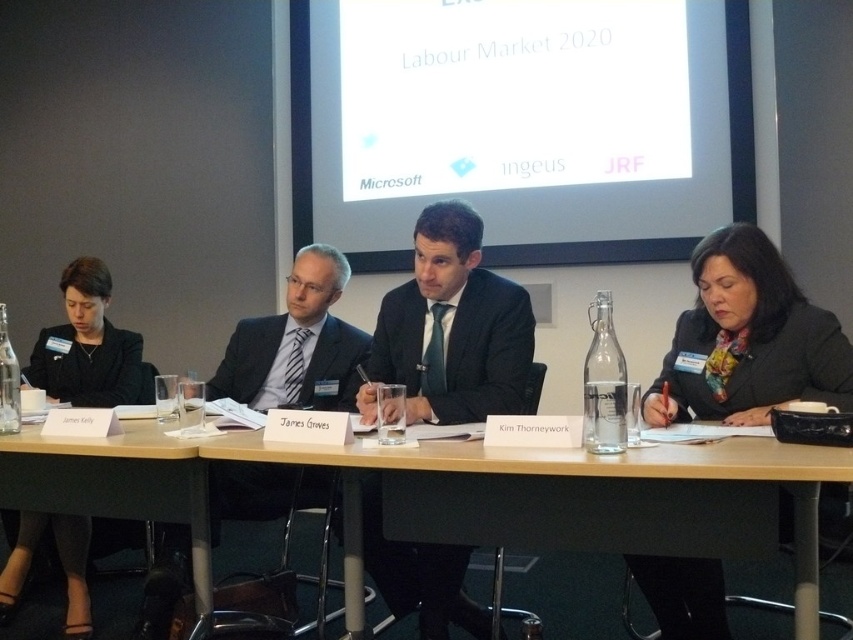
Question: Considering the relative positions of dark suit at center and white matte projector screen at upper center in the image provided, where is dark suit at center located with respect to white matte projector screen at upper center?

Choices:
 (A) left
 (B) right

Answer: (B)

Question: Among these points, which one is farthest from the camera?

Choices:
 (A) (648, 557)
 (B) (57, 372)
 (C) (306, 108)
 (D) (407, 596)

Answer: (C)

Question: Which point appears farthest from the camera in this image?

Choices:
 (A) tap(277, 392)
 (B) tap(737, 120)

Answer: (B)

Question: Among these points, which one is nearest to the camera?

Choices:
 (A) (146, 628)
 (B) (99, 552)

Answer: (A)

Question: Considering the relative positions of dark gray suit at center and black woolen blazer at center in the image provided, where is dark gray suit at center located with respect to black woolen blazer at center?

Choices:
 (A) above
 (B) below

Answer: (A)

Question: Considering the relative positions of black woolen blazer at center and white matte projector screen at upper center in the image provided, where is black woolen blazer at center located with respect to white matte projector screen at upper center?

Choices:
 (A) above
 (B) below

Answer: (B)